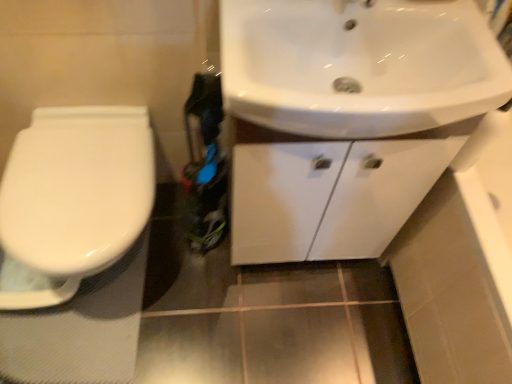
Where is `white glossy toilet at left`? white glossy toilet at left is located at coordinates (72, 200).

The width and height of the screenshot is (512, 384). Find the location of `white glossy sink at upper right`. white glossy sink at upper right is located at coordinates (359, 65).

Find the location of a particular element. The image size is (512, 384). white glossy cabinet at upper right is located at coordinates (330, 191).

Could you tell me if white glossy toilet at left is facing white glossy sink at upper right?

No, white glossy toilet at left is not facing towards white glossy sink at upper right.

Are white glossy toilet at left and white glossy sink at upper right located far from each other?

No, white glossy toilet at left is not far from white glossy sink at upper right.

How distant is white glossy toilet at left from white glossy sink at upper right?

The distance of white glossy toilet at left from white glossy sink at upper right is 23.29 inches.

Is point (154, 197) less distant than point (274, 32)?

That is False.

Is white glossy cabinet at upper right outside of white glossy toilet at left?

Indeed, white glossy cabinet at upper right is completely outside white glossy toilet at left.

How distant is white glossy cabinet at upper right from white glossy toilet at left?

They are 18.26 inches apart.

This screenshot has height=384, width=512. In order to click on toilet below the white glossy cabinet at upper right (from a real-world perspective) in this screenshot , I will do `click(72, 200)`.

Does white glossy sink at upper right turn towards white glossy cabinet at upper right?

No, white glossy sink at upper right does not turn towards white glossy cabinet at upper right.

Is white glossy sink at upper right taller or shorter than white glossy cabinet at upper right?

Clearly, white glossy sink at upper right is shorter compared to white glossy cabinet at upper right.

Looking at their sizes, would you say white glossy sink at upper right is wider or thinner than white glossy cabinet at upper right?

In the image, white glossy sink at upper right appears to be wider than white glossy cabinet at upper right.

Considering the sizes of objects white glossy toilet at left and white glossy cabinet at upper right in the image provided, who is wider, white glossy toilet at left or white glossy cabinet at upper right?

white glossy toilet at left.

Is point (102, 209) farther from viewer compared to point (445, 164)?

Yes, it is.

Find the location of a particular element. This screenshot has width=512, height=384. toilet that appears on the left of white glossy cabinet at upper right is located at coordinates pos(72,200).

Can you confirm if white glossy cabinet at upper right is bigger than white glossy sink at upper right?

Indeed, white glossy cabinet at upper right has a larger size compared to white glossy sink at upper right.

Which object is further away from the camera, white glossy cabinet at upper right or white glossy sink at upper right?

white glossy cabinet at upper right is further away from the camera.

Is white glossy cabinet at upper right at the left side of white glossy sink at upper right?

Yes, white glossy cabinet at upper right is to the left of white glossy sink at upper right.

How many degrees apart are the facing directions of white glossy cabinet at upper right and white glossy sink at upper right?

The facing directions of white glossy cabinet at upper right and white glossy sink at upper right are 0.255 degrees apart.

Is white glossy toilet at left located within white glossy sink at upper right?

No, white glossy sink at upper right does not contain white glossy toilet at left.

Between point (343, 10) and point (38, 194), which one is positioned in front?

The point (343, 10) is in front.

How distant is white glossy sink at upper right from white glossy toilet at left?

white glossy sink at upper right and white glossy toilet at left are 59.16 centimeters apart.

This screenshot has height=384, width=512. Identify the location of toilet on the left side of white glossy sink at upper right. (72, 200).

This screenshot has height=384, width=512. What are the coordinates of `bathroom cabinet above the white glossy toilet at left (from the image's perspective)` in the screenshot? It's located at (330, 191).

Based on their spatial positions, is white glossy toilet at left or white glossy sink at upper right further from white glossy cabinet at upper right?

white glossy toilet at left is further to white glossy cabinet at upper right.

When comparing their distances from white glossy sink at upper right, does white glossy cabinet at upper right or white glossy toilet at left seem further?

Based on the image, white glossy toilet at left appears to be further to white glossy sink at upper right.

Consider the image. Based on their spatial positions, is white glossy sink at upper right or white glossy toilet at left further from white glossy cabinet at upper right?

white glossy toilet at left is further to white glossy cabinet at upper right.

When comparing their distances from white glossy sink at upper right, does white glossy toilet at left or white glossy cabinet at upper right seem further?

white glossy toilet at left is further to white glossy sink at upper right.

Estimate the real-world distances between objects in this image. Which object is closer to white glossy toilet at left, white glossy cabinet at upper right or white glossy sink at upper right?

white glossy cabinet at upper right.

Based on the photo, when comparing their distances from white glossy toilet at left, does white glossy sink at upper right or white glossy cabinet at upper right seem further?

Based on the image, white glossy sink at upper right appears to be further to white glossy toilet at left.

Locate an element on the screen. bathroom cabinet located between white glossy toilet at left and white glossy sink at upper right in the left-right direction is located at coordinates (330, 191).